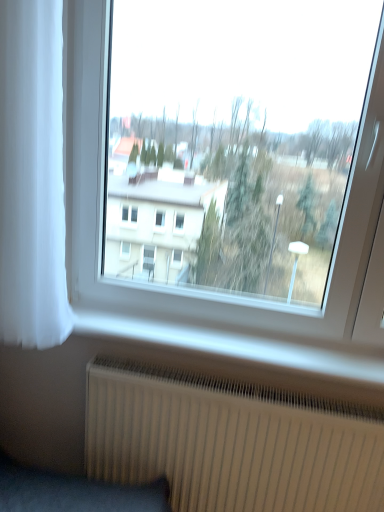
Image resolution: width=384 pixels, height=512 pixels. What do you see at coordinates (231, 441) in the screenshot? I see `white ribbed radiator at lower center` at bounding box center [231, 441].

Describe the element at coordinates (224, 158) in the screenshot. I see `transparent glass window at center` at that location.

Where is `white ribbed radiator at lower center`? Image resolution: width=384 pixels, height=512 pixels. white ribbed radiator at lower center is located at coordinates (231, 441).

Looking at the image, does transparent glass window at center seem bigger or smaller compared to white sheer curtain at left?

transparent glass window at center is bigger than white sheer curtain at left.

Can we say transparent glass window at center lies outside white sheer curtain at left?

That's correct, transparent glass window at center is outside of white sheer curtain at left.

Which object is more forward, transparent glass window at center or white sheer curtain at left?

white sheer curtain at left is in front.

Can you confirm if transparent glass window at center is shorter than white sheer curtain at left?

No, transparent glass window at center is not shorter than white sheer curtain at left.

What's the angular difference between transparent glass window at center and white ribbed radiator at lower center's facing directions?

There is a 0.000545-degree angle between the facing directions of transparent glass window at center and white ribbed radiator at lower center.

Is transparent glass window at center oriented towards white ribbed radiator at lower center?

No, transparent glass window at center is not oriented towards white ribbed radiator at lower center.

Considering the sizes of objects transparent glass window at center and white ribbed radiator at lower center in the image provided, who is shorter, transparent glass window at center or white ribbed radiator at lower center?

With less height is white ribbed radiator at lower center.

From the image's perspective, would you say transparent glass window at center is shown under white ribbed radiator at lower center?

No, from the image's perspective, transparent glass window at center is not beneath white ribbed radiator at lower center.

You are a GUI agent. You are given a task and a screenshot of the screen. Output one action in this format:
    pyautogui.click(x=<x>, y=<y>)
    Task: Click on the curtain on the left of the white ribbed radiator at lower center
    
    Given the screenshot: What is the action you would take?
    pyautogui.click(x=32, y=176)

Does white sheer curtain at left have a greater width compared to white ribbed radiator at lower center?

Yes.

Does white sheer curtain at left have a smaller size compared to white ribbed radiator at lower center?

No.

Considering the relative positions of white sheer curtain at left and white ribbed radiator at lower center in the image provided, is white sheer curtain at left to the right of white ribbed radiator at lower center from the viewer's perspective?

No, white sheer curtain at left is not to the right of white ribbed radiator at lower center.

Is white sheer curtain at left smaller than transparent glass window at center?

Yes, white sheer curtain at left is smaller than transparent glass window at center.

Could you tell me if white sheer curtain at left is facing transparent glass window at center?

No, white sheer curtain at left is not turned towards transparent glass window at center.

Considering the points (24, 338) and (348, 86), which point is in front, point (24, 338) or point (348, 86)?

The point (24, 338) is closer to the camera.

Can you confirm if white sheer curtain at left is thinner than transparent glass window at center?

No, white sheer curtain at left is not thinner than transparent glass window at center.

Measure the distance between white ribbed radiator at lower center and transparent glass window at center.

The distance of white ribbed radiator at lower center from transparent glass window at center is 1.05 meters.

From a real-world perspective, which is physically above, white ribbed radiator at lower center or transparent glass window at center?

transparent glass window at center, from a real-world perspective.

Based on their positions, is white ribbed radiator at lower center located to the left or right of transparent glass window at center?

In the image, white ribbed radiator at lower center appears on the left side of transparent glass window at center.

Which is closer to the camera, (96, 398) or (53, 95)?

Positioned in front is point (53, 95).

From the picture: Is white ribbed radiator at lower center not inside white sheer curtain at left?

Indeed, white ribbed radiator at lower center is completely outside white sheer curtain at left.

Can you confirm if white ribbed radiator at lower center is bigger than white sheer curtain at left?

→ Incorrect, white ribbed radiator at lower center is not larger than white sheer curtain at left.

Considering their positions, is white ribbed radiator at lower center located in front of or behind white sheer curtain at left?

Clearly, white ribbed radiator at lower center is behind white sheer curtain at left.

This screenshot has height=512, width=384. Identify the location of curtain that appears in front of the transparent glass window at center. [32, 176].

In order to click on window positioned vertically above the white ribbed radiator at lower center (from a real-world perspective) in this screenshot , I will do `click(224, 158)`.

From the image, which object appears to be farther from transparent glass window at center, white sheer curtain at left or white ribbed radiator at lower center?

Based on the image, white sheer curtain at left appears to be further to transparent glass window at center.

Based on their spatial positions, is white ribbed radiator at lower center or transparent glass window at center further from white sheer curtain at left?

transparent glass window at center lies further to white sheer curtain at left than the other object.

When comparing their distances from white sheer curtain at left, does transparent glass window at center or white ribbed radiator at lower center seem further?

Among the two, transparent glass window at center is located further to white sheer curtain at left.

Looking at the image, which one is located further to white ribbed radiator at lower center, white sheer curtain at left or transparent glass window at center?

transparent glass window at center is positioned further to the anchor white ribbed radiator at lower center.

When comparing their distances from transparent glass window at center, does white ribbed radiator at lower center or white sheer curtain at left seem closer?

The object closer to transparent glass window at center is white ribbed radiator at lower center.

Estimate the real-world distances between objects in this image. Which object is further from white ribbed radiator at lower center, transparent glass window at center or white sheer curtain at left?

transparent glass window at center is further to white ribbed radiator at lower center.

Locate an element on the screen. window between white sheer curtain at left and white ribbed radiator at lower center in the up-down direction is located at coordinates (224, 158).